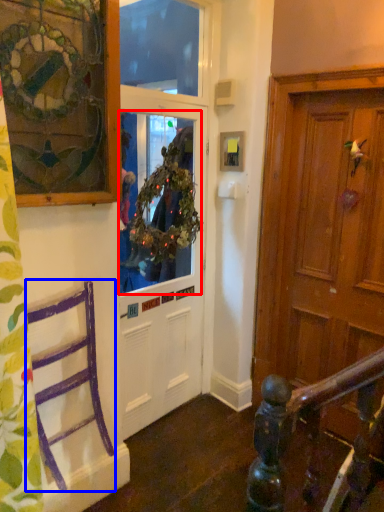
Question: Which object appears farthest to the camera in this image, window screen (highlighted by a red box) or chair (highlighted by a blue box)?

Choices:
 (A) window screen
 (B) chair

Answer: (A)